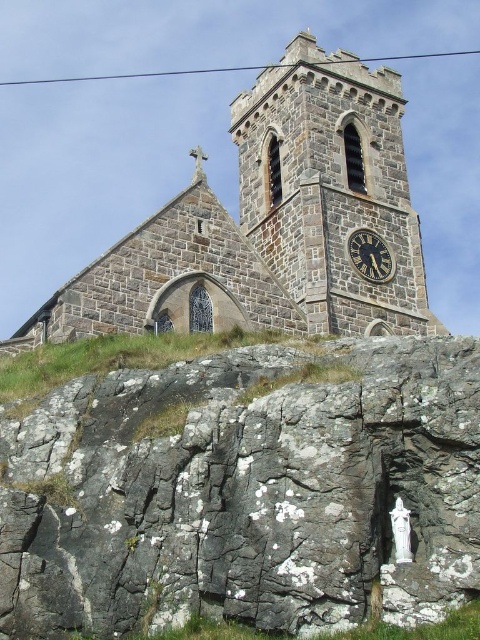
Does point (432, 422) lie behind point (287, 125)?

No, it is in front of (287, 125).

Does gray rough rock at lower center have a lesser height compared to stone clock tower at upper center?

Yes, gray rough rock at lower center is shorter than stone clock tower at upper center.

Which is behind, point (204, 426) or point (398, 243)?

The point (398, 243) is more distant.

Where is `gray rough rock at lower center`? Image resolution: width=480 pixels, height=640 pixels. gray rough rock at lower center is located at coordinates (245, 493).

Is dark stone church at upper center further to the viewer compared to stone clock tower at upper center?

No, dark stone church at upper center is in front of stone clock tower at upper center.

Between dark stone church at upper center and stone clock tower at upper center, which one is positioned higher?

stone clock tower at upper center is above.

Identify the location of dark stone church at upper center. Image resolution: width=480 pixels, height=640 pixels. (275, 218).

In the scene shown: Is stone clock tower at upper center thinner than dark gray stone clock at center?

Incorrect, stone clock tower at upper center's width is not less than dark gray stone clock at center's.

Where is `stone clock tower at upper center`? stone clock tower at upper center is located at coordinates (331, 188).

Where is `stone clock tower at upper center`? stone clock tower at upper center is located at coordinates (x=331, y=188).